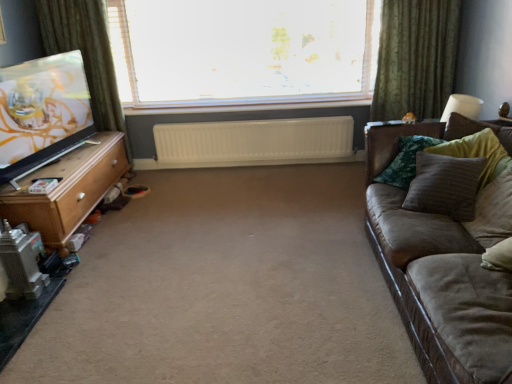
This screenshot has height=384, width=512. Find the location of `free area below white plastic radiator at center (from a real-world perspective)`. free area below white plastic radiator at center (from a real-world perspective) is located at coordinates (218, 168).